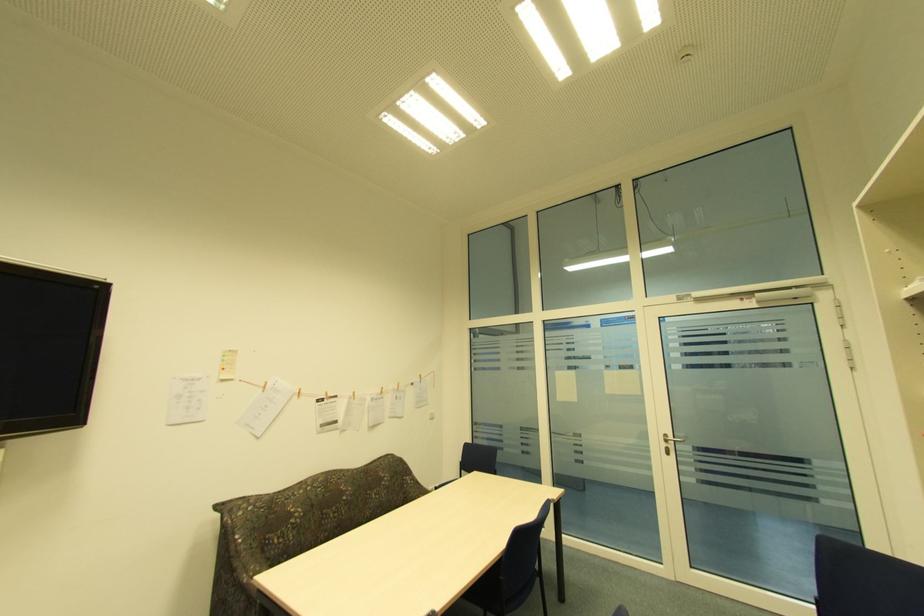
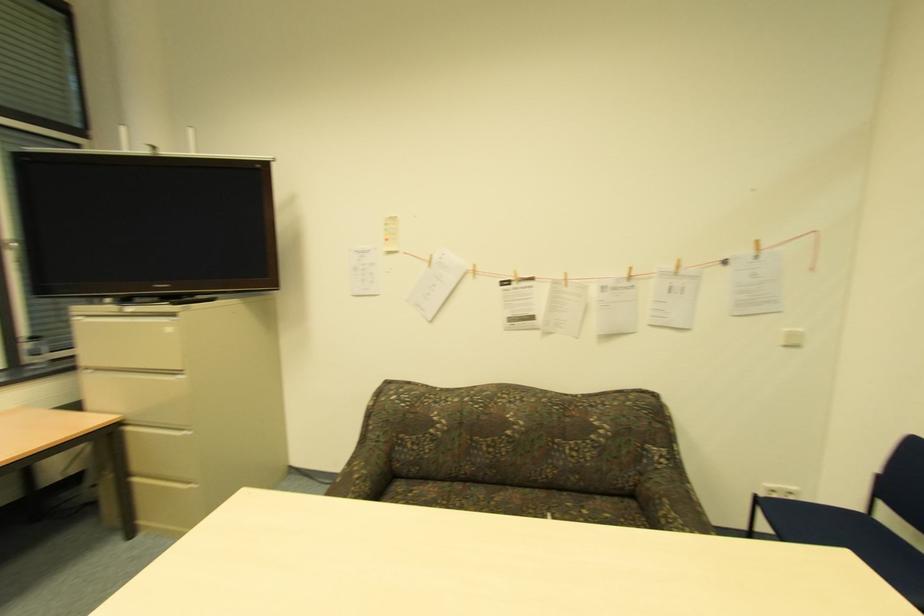
The point at (383, 392) is marked in the first image. Where is the corresponding point in the second image?

(626, 276)